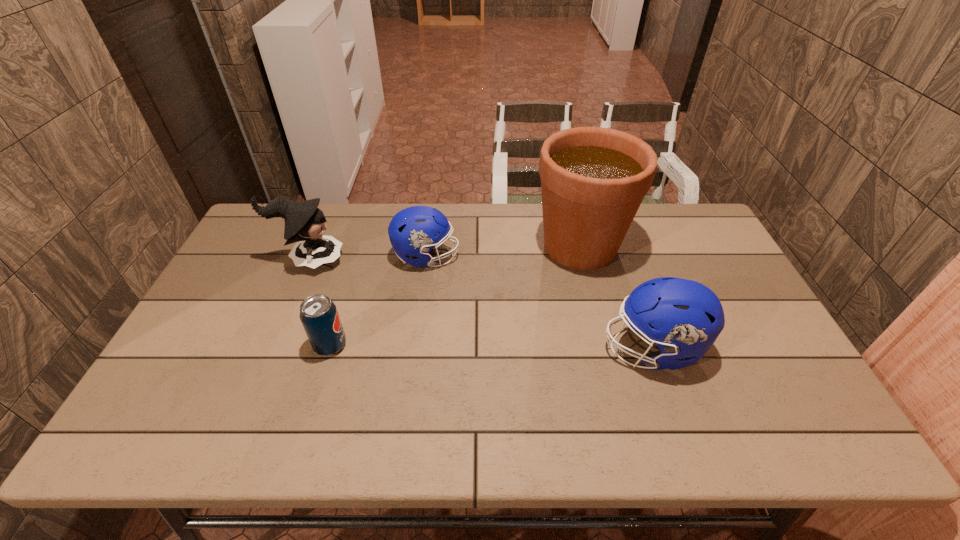
The height and width of the screenshot is (540, 960). Find the location of `flowerpot`. flowerpot is located at coordinates (593, 180).

The width and height of the screenshot is (960, 540). In order to click on doll in this screenshot , I will do `click(304, 221)`.

Identify the location of the taller football helmet. This screenshot has height=540, width=960. (686, 316).

This screenshot has height=540, width=960. Identify the location of the nearer football helmet. (686, 316).

Find the location of `the farther football helmet`. the farther football helmet is located at coordinates (413, 231).

The height and width of the screenshot is (540, 960). I want to click on the shorter football helmet, so click(x=413, y=231).

Where is `the shortest object`? The width and height of the screenshot is (960, 540). the shortest object is located at coordinates [319, 316].

I want to click on vacant space located 0.300m on the front of the tallest object, so click(610, 363).

Find the location of a particular element. vacant space situated 0.090m at the face of the doll is located at coordinates (372, 260).

Where is `free space located on the front-facing side of the taller football helmet`? This screenshot has height=540, width=960. free space located on the front-facing side of the taller football helmet is located at coordinates (533, 348).